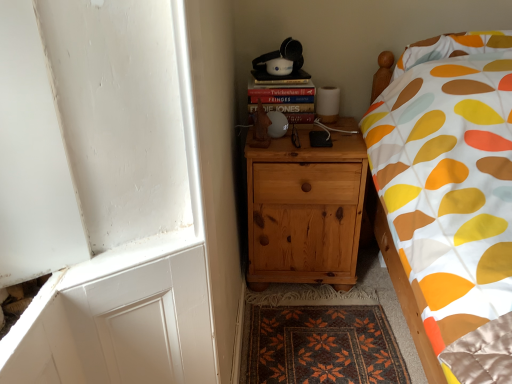
At what (x,y) coordinates should I click in order to perform the action: click on spots to the right of wooden statue at center. Please return your answer as a coordinate pair (x, y). The image size is (512, 384). Looking at the image, I should click on (298, 147).